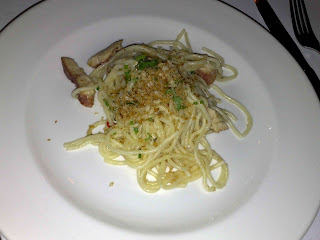
The image size is (320, 240). In order to click on plate rim in this screenshot , I will do `click(34, 211)`.